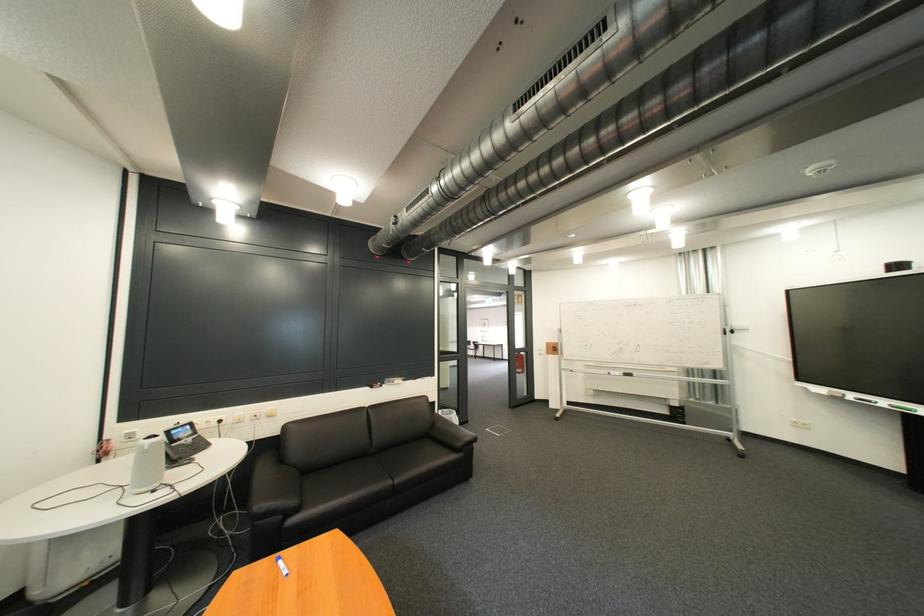
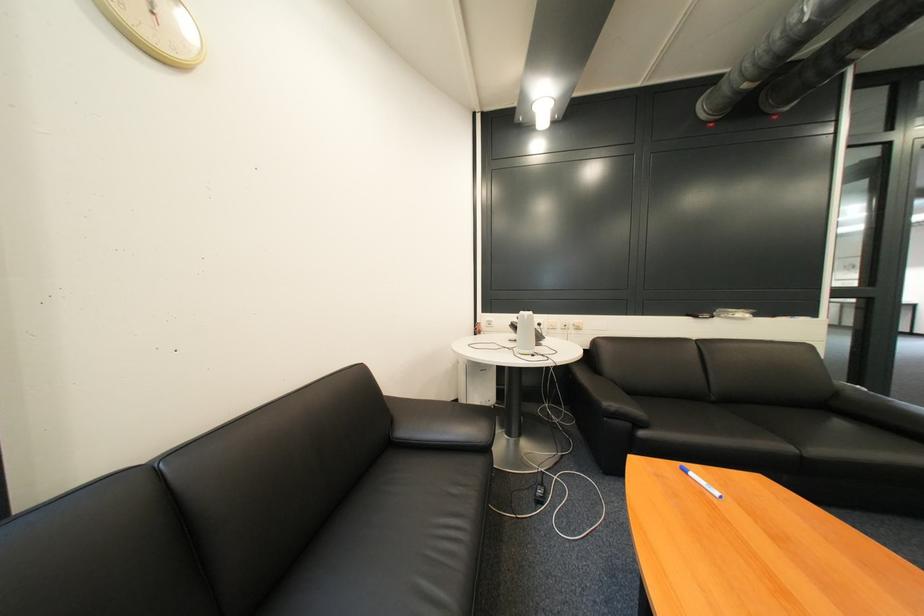
Question: The images are taken continuously from a first-person perspective. In which direction is your viewpoint rotating?

Choices:
 (A) Left
 (B) Right
 (C) Up
 (D) Down

Answer: (A)